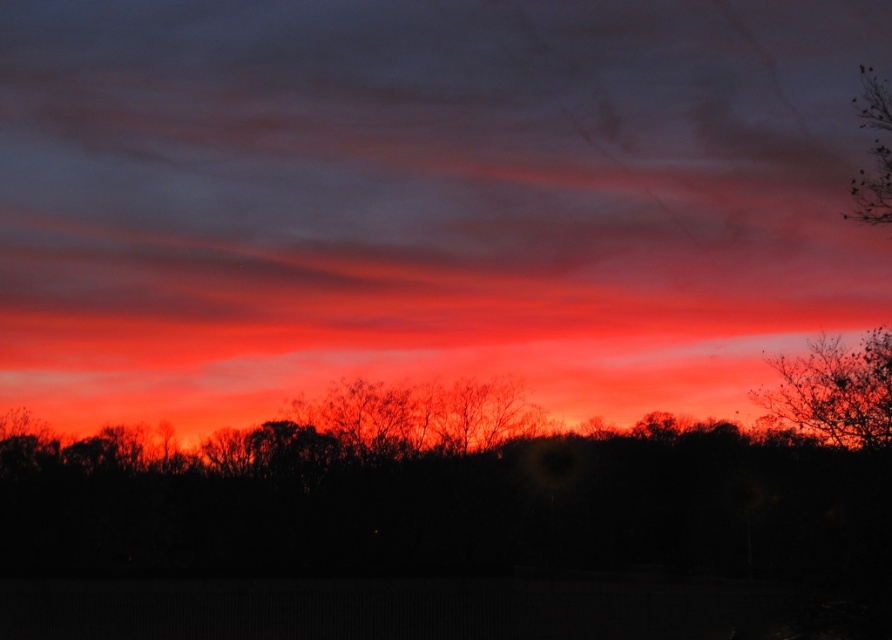
Between matte orange cloud at center and silhouetted bare branches at upper right, which one appears on the right side from the viewer's perspective?

silhouetted bare branches at upper right is more to the right.

Based on the photo, is the position of matte orange cloud at center less distant than that of silhouetted bare branches at upper right?

No.

This screenshot has width=892, height=640. I want to click on matte orange cloud at center, so click(x=426, y=200).

Can you confirm if matte orange cloud at center is bigger than silhouette bare tree at upper right?

Yes, matte orange cloud at center is bigger than silhouette bare tree at upper right.

You are a GUI agent. You are given a task and a screenshot of the screen. Output one action in this format:
    pyautogui.click(x=<x>, y=<y>)
    Task: Click on the matte orange cloud at center
    The height and width of the screenshot is (640, 892).
    Given the screenshot: What is the action you would take?
    pyautogui.click(x=426, y=200)

Is point (847, 362) positioned in front of point (882, 176)?

No, (847, 362) is further to viewer.

From the picture: Is silhouetted bare branches at upper right positioned in front of silhouette bare tree at upper right?

No, silhouetted bare branches at upper right is further to the viewer.

This screenshot has width=892, height=640. In order to click on silhouetted bare branches at upper right in this screenshot , I will do `click(835, 390)`.